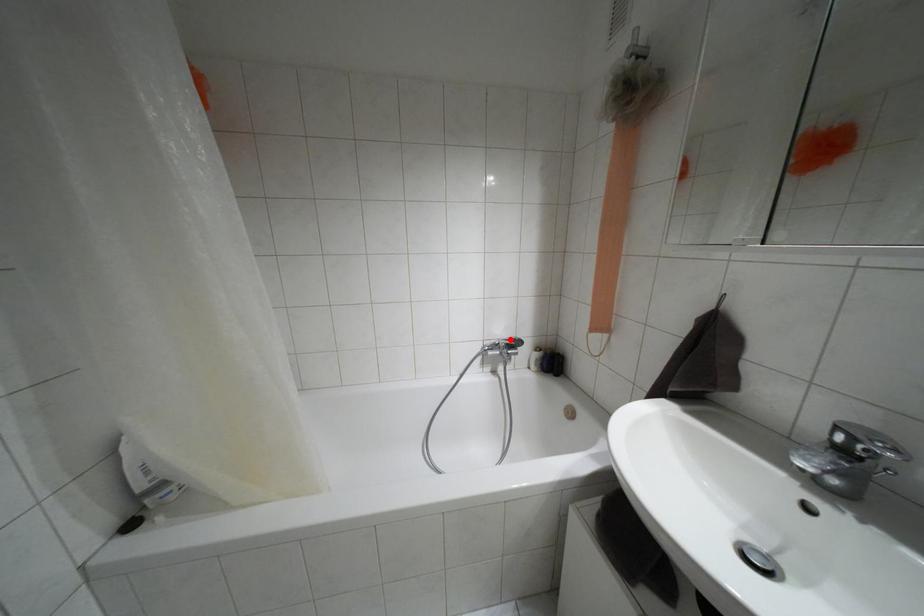
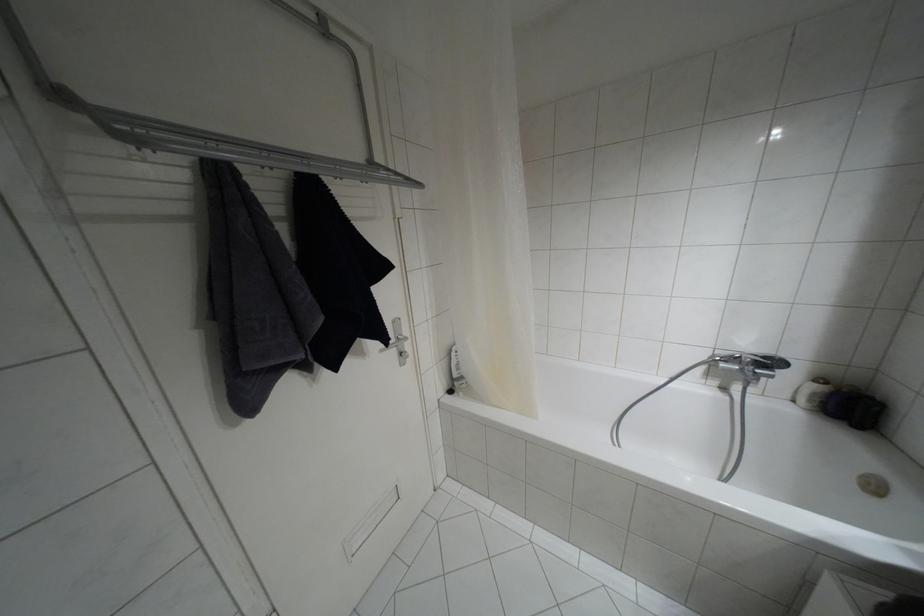
Where in the second image is the point corresponding to the highlighted location from the first image?

(763, 357)